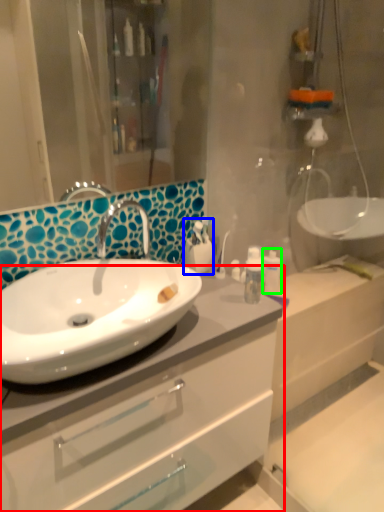
Question: Considering the real-world distances, which object is closest to bathroom cabinet (highlighted by a red box)? toiletry (highlighted by a blue box) or toiletry (highlighted by a green box).

Choices:
 (A) toiletry
 (B) toiletry

Answer: (A)